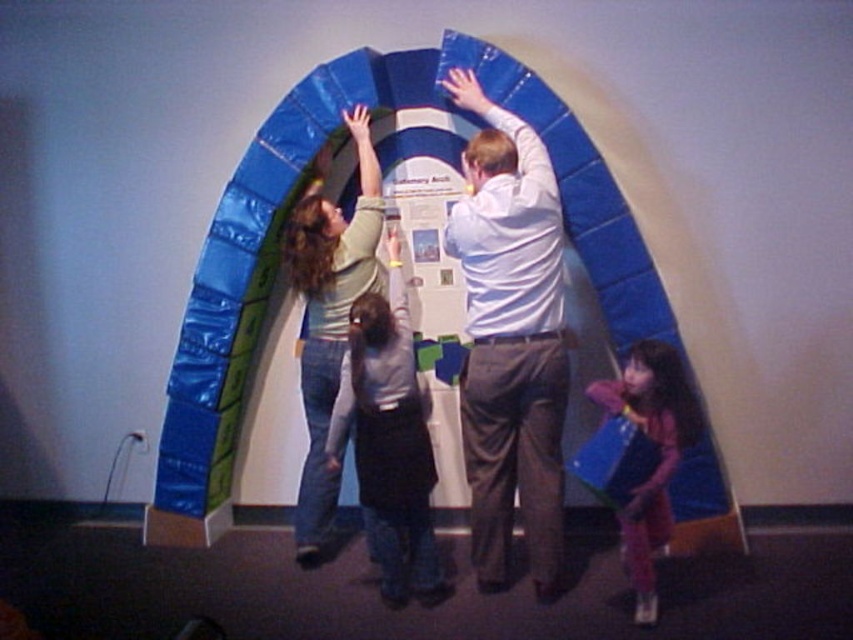
Question: Which object appears closest to the camera in this image?

Choices:
 (A) white matte shirt at center
 (B) matte pink dress at lower right
 (C) matte gray sweater at center

Answer: (B)

Question: Where is white matte shirt at center located in relation to matte green shirt at center in the image?

Choices:
 (A) right
 (B) left

Answer: (A)

Question: Does matte gray sweater at center have a greater width compared to matte pink dress at lower right?

Choices:
 (A) yes
 (B) no

Answer: (A)

Question: Can you confirm if white matte shirt at center is positioned above matte pink dress at lower right?

Choices:
 (A) no
 (B) yes

Answer: (B)

Question: Which point is closer to the camera?

Choices:
 (A) matte green shirt at center
 (B) matte gray sweater at center
 (C) white matte shirt at center

Answer: (C)

Question: Which point appears farthest from the camera in this image?

Choices:
 (A) (486, 305)
 (B) (376, 531)
 (C) (326, 492)

Answer: (C)